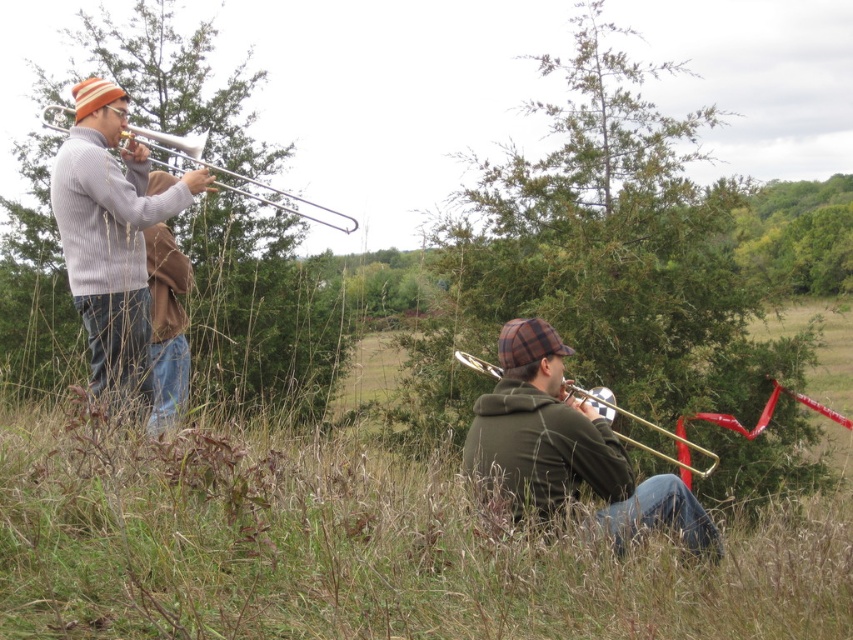
Which is above, knit wool sweater at left or matte silver trombone at left?

matte silver trombone at left is above.

Is knit wool sweater at left wider than matte silver trombone at left?

In fact, knit wool sweater at left might be narrower than matte silver trombone at left.

Is point (74, 234) more distant than point (309, 211)?

That is False.

Find the location of a particular element. This screenshot has height=640, width=853. knit wool sweater at left is located at coordinates (122, 248).

Does matte silver trombone at left appear on the left side of shiny brass trumpet at lower right?

Yes, matte silver trombone at left is to the left of shiny brass trumpet at lower right.

Does point (270, 186) come farther from viewer compared to point (469, 356)?

That is True.

You are a GUI agent. You are given a task and a screenshot of the screen. Output one action in this format:
    pyautogui.click(x=<x>, y=<y>)
    Task: Click on the matte silver trombone at left
    The image size is (853, 640).
    Given the screenshot: What is the action you would take?
    pyautogui.click(x=231, y=176)

Can you confirm if knit wool sweater at left is bigger than shiny brass trumpet at lower right?

Incorrect, knit wool sweater at left is not larger than shiny brass trumpet at lower right.

Does knit wool sweater at left appear on the left side of shiny brass trumpet at lower right?

Yes, knit wool sweater at left is to the left of shiny brass trumpet at lower right.

Identify the location of knit wool sweater at left. The height and width of the screenshot is (640, 853). (122, 248).

The height and width of the screenshot is (640, 853). Identify the location of knit wool sweater at left. (122, 248).